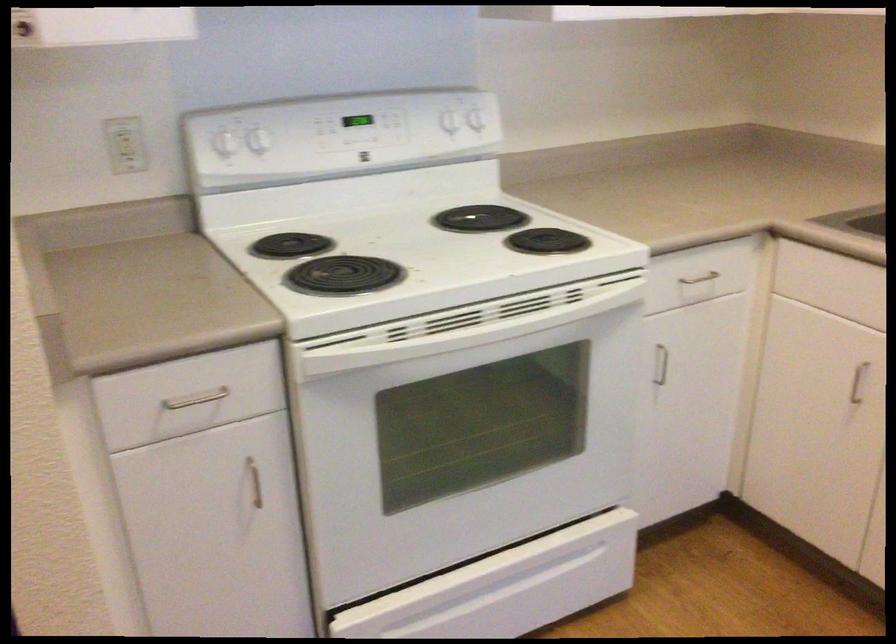
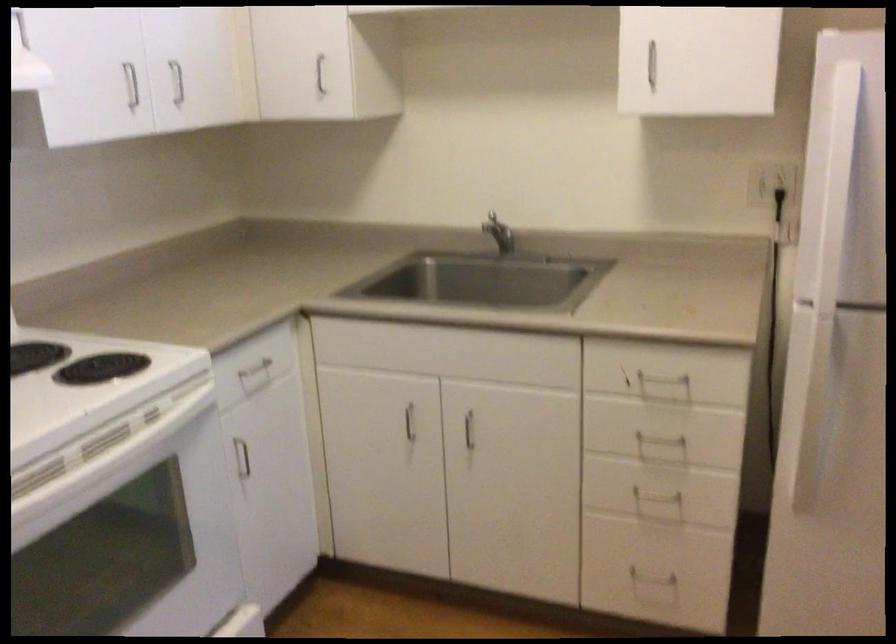
Locate, in the second image, the point that corresponds to (x=660, y=365) in the first image.

(242, 458)